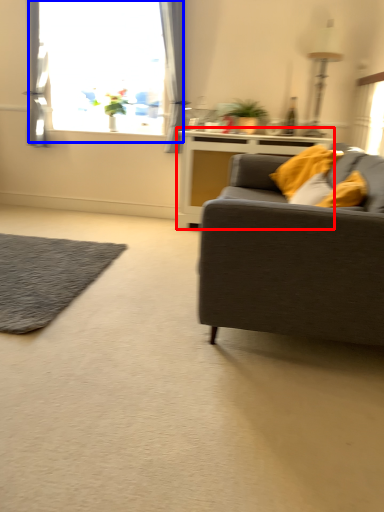
Question: Which point is closer to the camera, table (highlighted by a red box) or window (highlighted by a blue box)?

Choices:
 (A) table
 (B) window

Answer: (A)